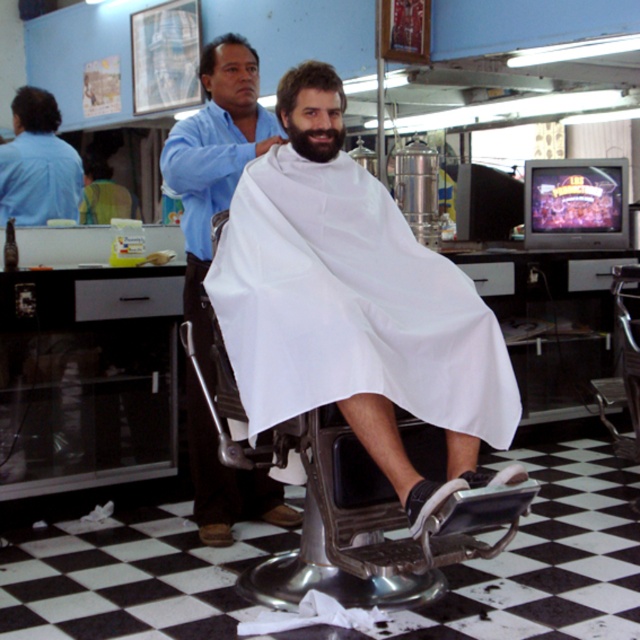
Question: Which point appears closest to the camera in this image?

Choices:
 (A) (257, 56)
 (B) (17, 221)
 (C) (284, 77)

Answer: (C)

Question: Where is smooth brown hair at upper center located in relation to brown matte hair at center in the image?

Choices:
 (A) right
 (B) left

Answer: (B)

Question: Is blue shirt at upper left bigger than brown fuzzy beard at center?

Choices:
 (A) no
 (B) yes

Answer: (B)

Question: Which point is farther to the camera?

Choices:
 (A) (289, 131)
 (B) (374, 417)

Answer: (A)

Question: Which point is closer to the camera?

Choices:
 (A) dark brown hair at upper left
 (B) blue shirt at upper left

Answer: (B)

Question: Is white cloth at center behind brown matte hair at center?

Choices:
 (A) yes
 (B) no

Answer: (B)